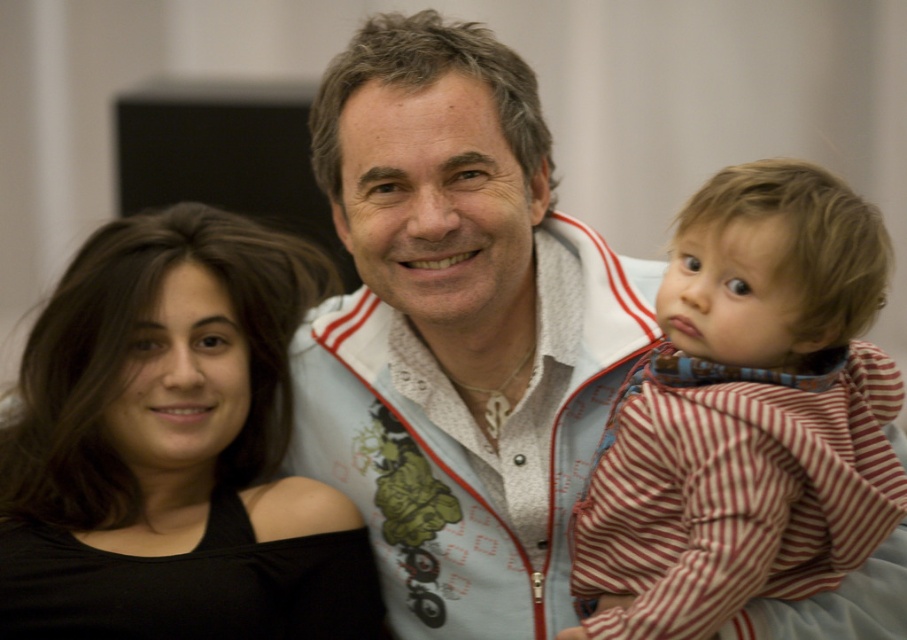
Question: Considering the real-world distances, which object is closest to the white textured jacket at center?

Choices:
 (A) black matte shirt at left
 (B) striped cotton shirt at right

Answer: (A)

Question: Which object appears closest to the camera in this image?

Choices:
 (A) black matte shirt at left
 (B) white textured jacket at center
 (C) striped cotton shirt at right

Answer: (C)

Question: Observing the image, what is the correct spatial positioning of white textured jacket at center in reference to striped cotton shirt at right?

Choices:
 (A) below
 (B) above

Answer: (B)

Question: Does white textured jacket at center have a smaller size compared to striped cotton shirt at right?

Choices:
 (A) no
 (B) yes

Answer: (A)

Question: Can you confirm if white textured jacket at center is thinner than black matte shirt at left?

Choices:
 (A) no
 (B) yes

Answer: (B)

Question: Which object appears farthest from the camera in this image?

Choices:
 (A) striped cotton shirt at right
 (B) white textured jacket at center
 (C) black matte shirt at left

Answer: (C)